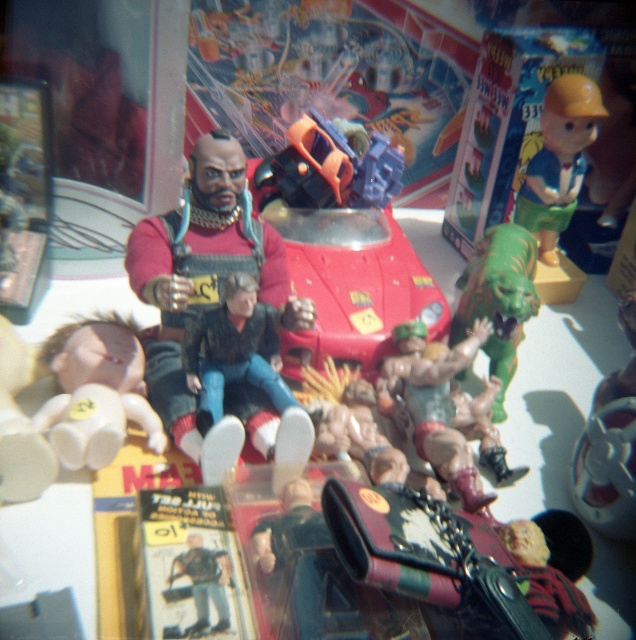
Question: Is matte black figure at center to the right of white matte baby doll at lower left from the viewer's perspective?

Choices:
 (A) yes
 (B) no

Answer: (A)

Question: Among these objects, which one is nearest to the camera?

Choices:
 (A) matte plastic toy at upper right
 (B) metallic red car at center
 (C) matte black figure at center

Answer: (C)

Question: Which of the following is the closest to the observer?

Choices:
 (A) metallic red car at center
 (B) matte black figure at center
 (C) white matte baby doll at lower left
 (D) green rubber toy at center

Answer: (B)

Question: Which object appears closest to the camera in this image?

Choices:
 (A) metallic red car at center
 (B) white matte baby doll at lower left

Answer: (B)

Question: Is matte black figure at center to the left of matte plastic toy at upper right from the viewer's perspective?

Choices:
 (A) yes
 (B) no

Answer: (A)

Question: Is matte plastic toy at upper right closer to camera compared to green rubber toy at center?

Choices:
 (A) yes
 (B) no

Answer: (B)